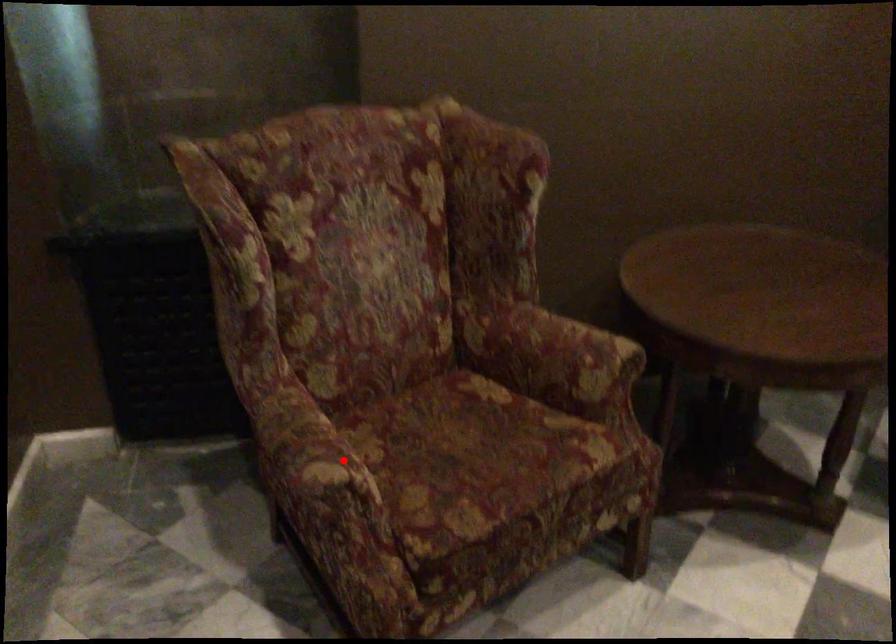
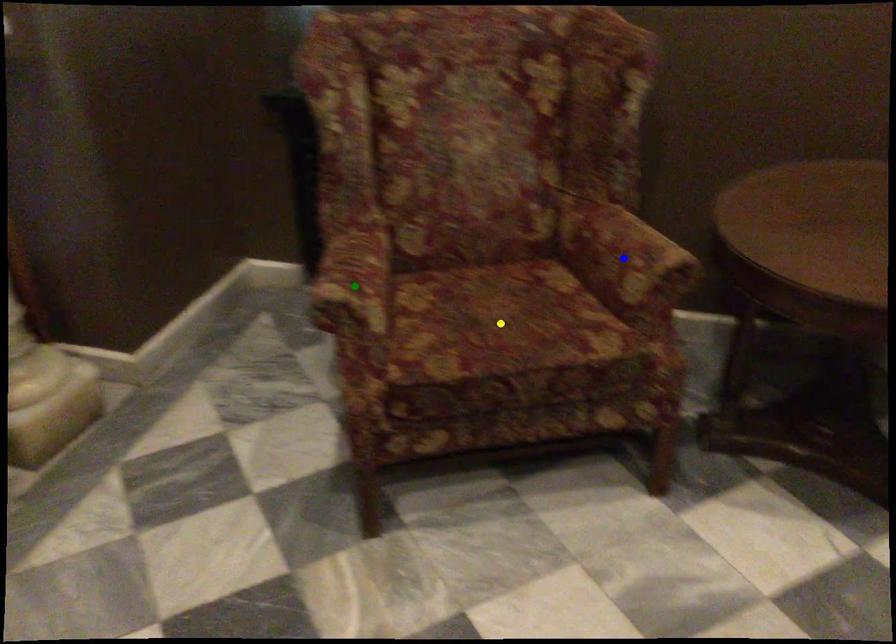
Question: I am providing you with two images of the same scene from different viewpoints. A red point is marked on the first image. You are given multiple points on the second image. Can you choose the point in image 2 that corresponds to the point in image 1?

Choices:
 (A) green point
 (B) yellow point
 (C) blue point

Answer: (A)